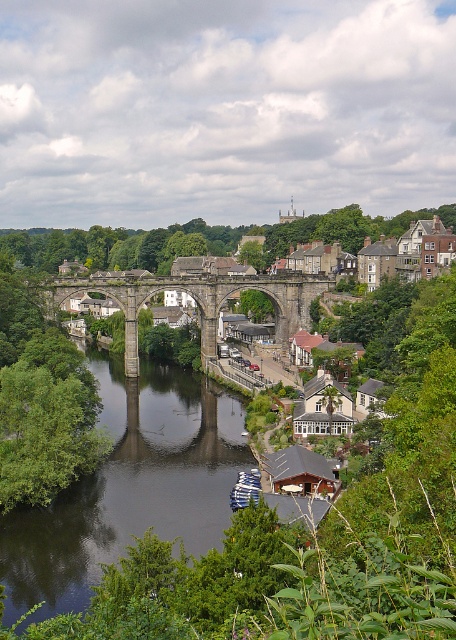
Question: Which of the following is the closest to the observer?

Choices:
 (A) (71, 294)
 (B) (162, 506)

Answer: (B)

Question: Does dark reflective water at center have a smaller size compared to stone arch bridge at center?

Choices:
 (A) no
 (B) yes

Answer: (B)

Question: Which of the following is the farthest from the observer?

Choices:
 (A) (202, 406)
 (B) (291, 288)

Answer: (B)

Question: Does dark reflective water at center appear on the right side of stone arch bridge at center?

Choices:
 (A) yes
 (B) no

Answer: (A)

Question: Is dark reflective water at center wider than stone arch bridge at center?

Choices:
 (A) yes
 (B) no

Answer: (B)